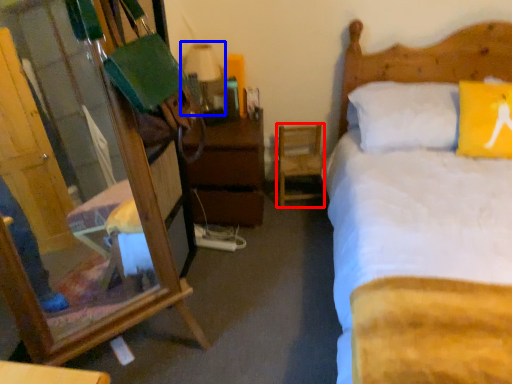
Question: Which of the following is the closest to the observer, chair (highlighted by a red box) or table lamp (highlighted by a blue box)?

Choices:
 (A) chair
 (B) table lamp

Answer: (B)